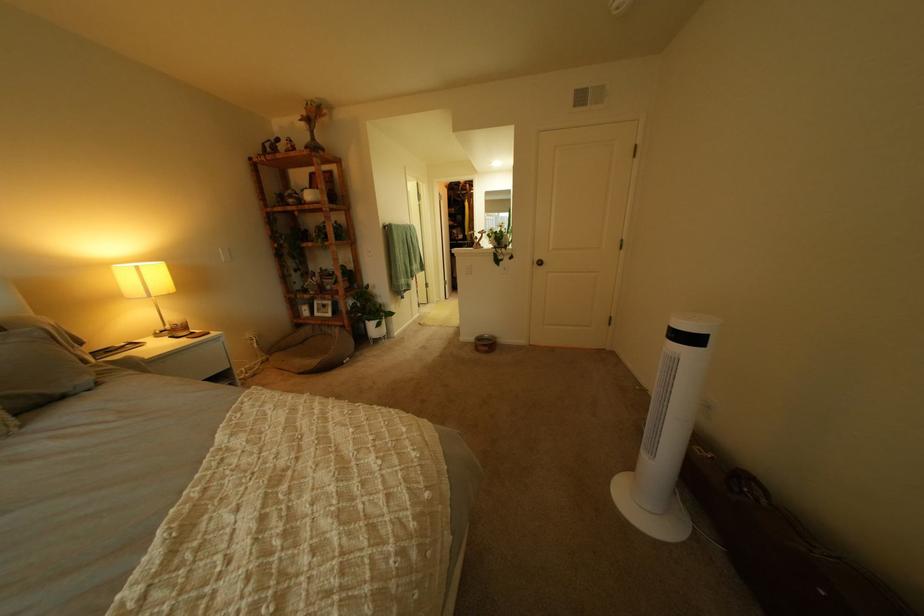
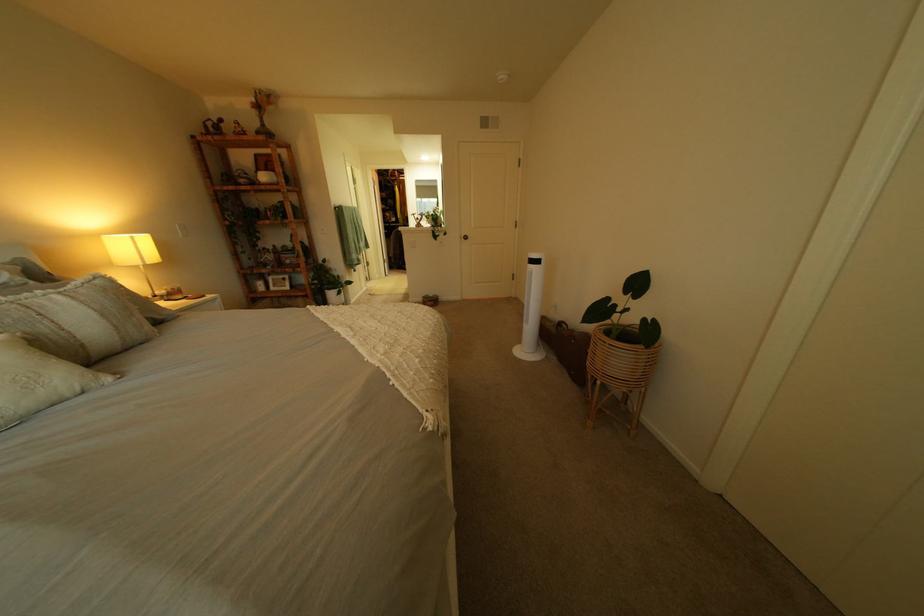
The images are taken continuously from a first-person perspective. In which direction are you moving?

The movement direction of the cameraman is left, backward.